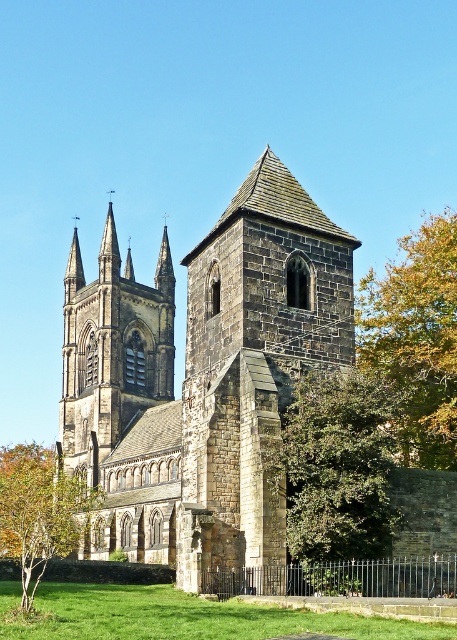
Question: Which point is closer to the camera taking this photo?

Choices:
 (A) (384, 452)
 (B) (15, 486)
 (C) (435, 628)
 (D) (413, 429)

Answer: (C)

Question: Estimate the real-world distances between objects in this image. Which object is farther from the dark gray stone church at center?

Choices:
 (A) green leafy tree at lower left
 (B) green grass at lower center

Answer: (B)

Question: Observing the image, what is the correct spatial positioning of green leafy tree at right in reference to green grass at lower center?

Choices:
 (A) above
 (B) below

Answer: (A)

Question: Does green leafy tree at center have a lesser width compared to green grass at lower center?

Choices:
 (A) no
 (B) yes

Answer: (B)

Question: Can you confirm if dark gray stone church at center is smaller than green leafy tree at center?

Choices:
 (A) yes
 (B) no

Answer: (B)

Question: Which object is the farthest from the dark gray stone church at center?

Choices:
 (A) green grass at lower center
 (B) green leafy tree at lower left
 (C) green leafy tree at right
 (D) green leafy tree at center

Answer: (C)